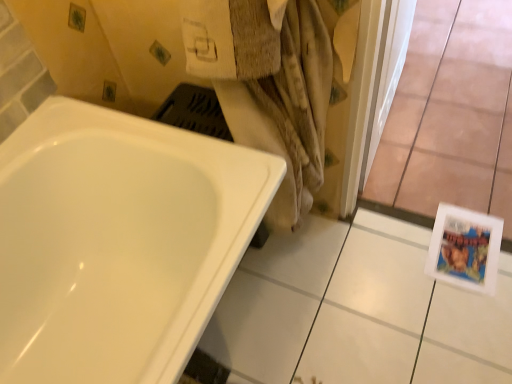
Question: In terms of height, does white glossy bathtub at lower left look taller or shorter compared to transparent glass door at lower right?

Choices:
 (A) tall
 (B) short

Answer: (A)

Question: In terms of width, does white glossy bathtub at lower left look wider or thinner when compared to transparent glass door at lower right?

Choices:
 (A) wide
 (B) thin

Answer: (B)

Question: Considering the real-world distances, which object is closest to the white glossy tile at lower right?

Choices:
 (A) beige textured towel at center
 (B) transparent glass door at lower right
 (C) white glossy bathtub at lower left

Answer: (A)

Question: Which of these objects is positioned farthest from the white glossy tile at lower right?

Choices:
 (A) beige textured towel at center
 (B) white glossy bathtub at lower left
 (C) transparent glass door at lower right

Answer: (B)